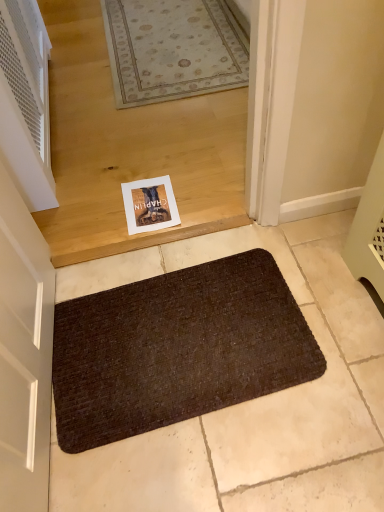
You are a GUI agent. You are given a task and a screenshot of the screen. Output one action in this format:
    pyautogui.click(x=<x>, y=<y>)
    Task: Click on the empty space that is to the right of brown textured bath mat at lower center
    
    Given the screenshot: What is the action you would take?
    (324, 324)